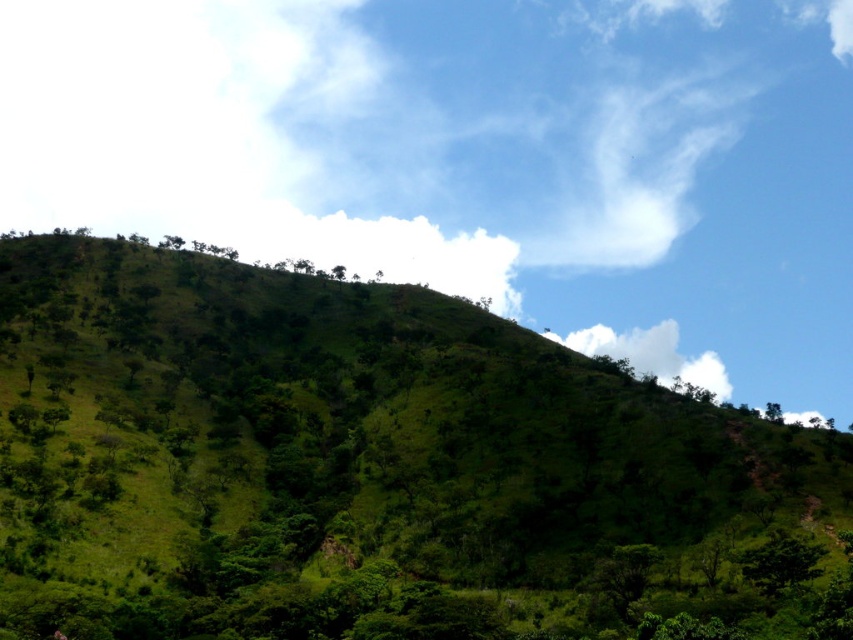
Question: Does green leafy tree at lower right have a lesser width compared to green leafy tree at upper center?

Choices:
 (A) no
 (B) yes

Answer: (A)

Question: Is green leafy hillside at center thinner than green leafy tree at lower right?

Choices:
 (A) yes
 (B) no

Answer: (B)

Question: Based on their relative distances, which object is nearer to the green leafy tree at upper center?

Choices:
 (A) white fluffy cloud at upper center
 (B) green leafy hillside at center
 (C) green leafy tree at lower right

Answer: (B)

Question: Which of these objects is positioned closest to the green leafy tree at lower right?

Choices:
 (A) green leafy hillside at center
 (B) white fluffy cloud at upper center
 (C) green leafy tree at upper center

Answer: (A)

Question: Does white fluffy cloud at upper center appear under green leafy tree at upper center?

Choices:
 (A) no
 (B) yes

Answer: (B)

Question: Among these points, which one is nearest to the camera?

Choices:
 (A) (801, 579)
 (B) (335, 272)
 (C) (711, 550)
 (D) (714, 369)

Answer: (A)